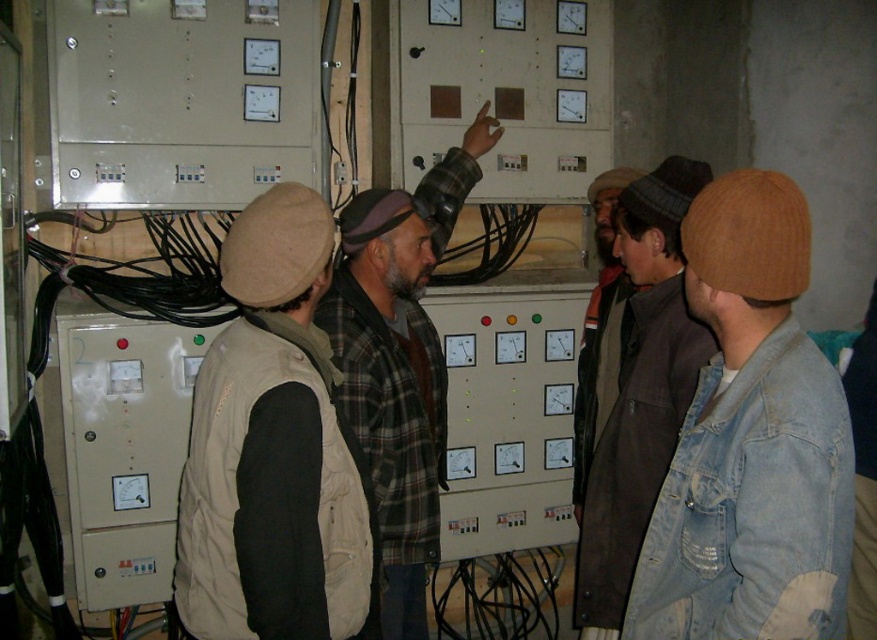
Is beige fabric vest at center closer to camera compared to brown woolen hat at center?

Yes, it is in front of brown woolen hat at center.

Does point (182, 492) lie in front of point (603, 182)?

Yes, it is.

Is point (232, 364) more distant than point (590, 182)?

No.

The width and height of the screenshot is (877, 640). Find the location of `beige fabric vest at center`. beige fabric vest at center is located at coordinates (272, 449).

Who is positioned more to the right, faded denim jacket at lower right or beige fabric vest at center?

Positioned to the right is faded denim jacket at lower right.

Is faded denim jacket at lower right further to camera compared to beige fabric vest at center?

No, faded denim jacket at lower right is closer to the viewer.

Does point (781, 452) come in front of point (227, 483)?

Yes, point (781, 452) is in front of point (227, 483).

This screenshot has width=877, height=640. I want to click on faded denim jacket at lower right, so click(750, 440).

Is faded denim jacket at lower right shorter than denim jacket at center?

Correct, faded denim jacket at lower right is not as tall as denim jacket at center.

Is faded denim jacket at lower right to the right of denim jacket at center from the viewer's perspective?

Correct, you'll find faded denim jacket at lower right to the right of denim jacket at center.

Does point (707, 624) come farther from viewer compared to point (608, 291)?

No, (707, 624) is in front of (608, 291).

At what (x,y) coordinates should I click in order to perform the action: click on faded denim jacket at lower right. Please return your answer as a coordinate pair (x, y). Image resolution: width=877 pixels, height=640 pixels. Looking at the image, I should click on (750, 440).